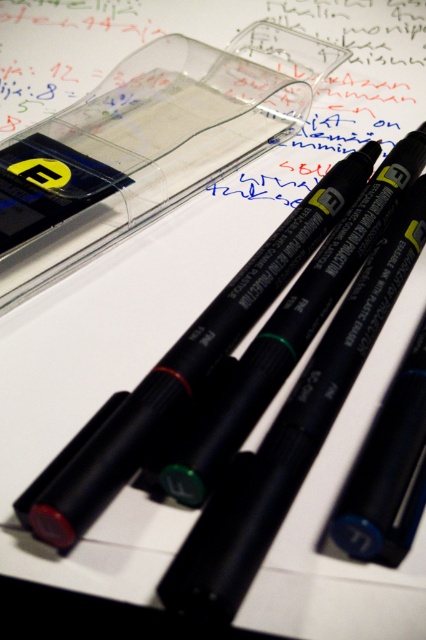
Question: Is matte black pen at center to the left of rubber eraser at lower left from the viewer's perspective?

Choices:
 (A) no
 (B) yes

Answer: (A)

Question: Which object is closer to the camera taking this photo?

Choices:
 (A) rubber eraser at lower left
 (B) matte black pen at center

Answer: (A)

Question: Is matte black pen at center bigger than rubber eraser at lower left?

Choices:
 (A) no
 (B) yes

Answer: (B)

Question: Which object appears farthest from the camera in this image?

Choices:
 (A) matte black pen at center
 (B) rubber eraser at lower left

Answer: (A)

Question: Where is matte black pen at center located in relation to rubber eraser at lower left in the image?

Choices:
 (A) left
 (B) right

Answer: (B)